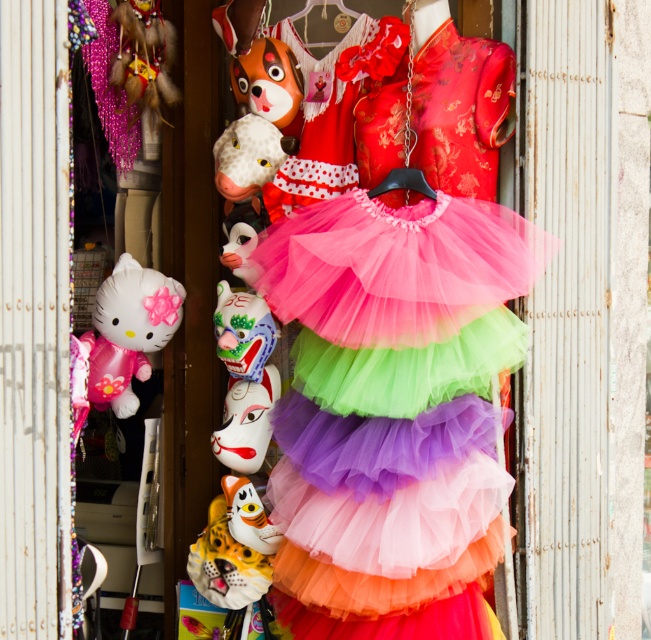
Who is lower down, matte pink plush at left or matte yellow plush toy at center?

Positioned lower is matte yellow plush toy at center.

Does point (111, 376) lie behind point (273, 531)?

No, it is in front of (273, 531).

Does point (158, 316) lie in front of point (268, 531)?

No.

Where is `matte pink plush at left`? matte pink plush at left is located at coordinates (128, 330).

Does matte pink plush at left have a lesser height compared to matte white mask at center?

No, matte pink plush at left is not shorter than matte white mask at center.

In the scene shown: Can you confirm if matte pink plush at left is bigger than matte white mask at center?

Indeed, matte pink plush at left has a larger size compared to matte white mask at center.

What do you see at coordinates (128, 330) in the screenshot? I see `matte pink plush at left` at bounding box center [128, 330].

At what (x,y) coordinates should I click in order to perform the action: click on matte pink plush at left. Please return your answer as a coordinate pair (x, y). Looking at the image, I should click on (128, 330).

Does matte pink plush at left appear over porcelain painted mask at center?

Correct, matte pink plush at left is located above porcelain painted mask at center.

From the picture: Can you confirm if matte pink plush at left is smaller than porcelain painted mask at center?

No, matte pink plush at left is not smaller than porcelain painted mask at center.

Image resolution: width=651 pixels, height=640 pixels. I want to click on matte pink plush at left, so pos(128,330).